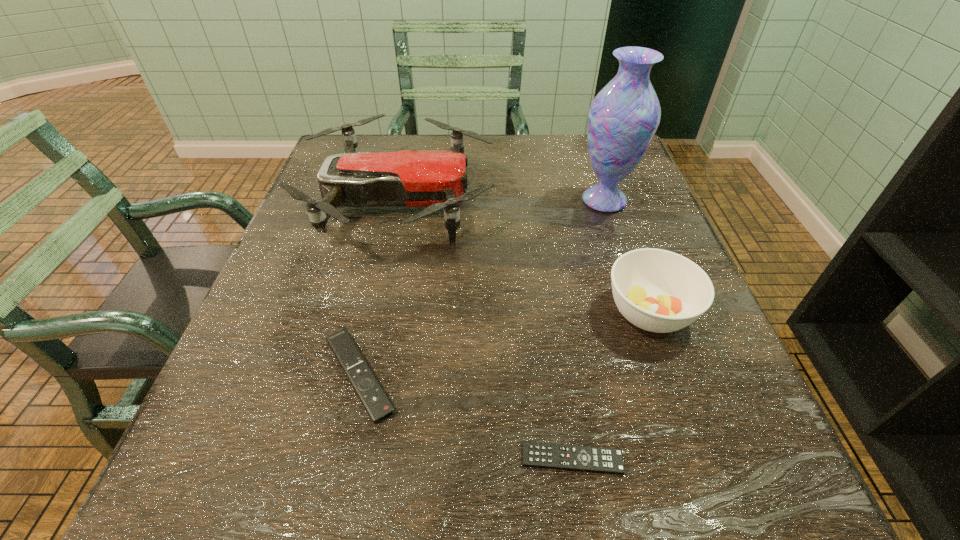
Identify the location of vacant space that satisfies the following two spatial constraints: 1. on the back side of the soup bowl; 2. on the front-facing side of the drone. This screenshot has width=960, height=540. (611, 202).